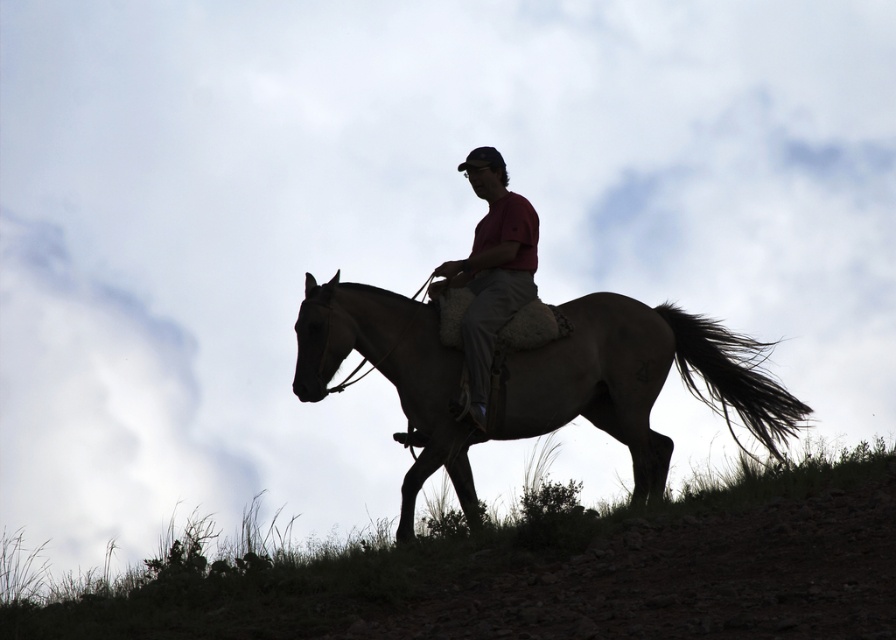
Based on the photo, can you confirm if brown textured horse at center is bigger than matte red shirt at center?

Indeed, brown textured horse at center has a larger size compared to matte red shirt at center.

Does point (530, 429) come farther from viewer compared to point (463, 266)?

No, (530, 429) is in front of (463, 266).

You are a GUI agent. You are given a task and a screenshot of the screen. Output one action in this format:
    pyautogui.click(x=<x>, y=<y>)
    Task: Click on the brown textured horse at center
    This screenshot has height=640, width=896.
    Given the screenshot: What is the action you would take?
    pyautogui.click(x=533, y=378)

Is green grass at lower center further to camera compared to brown textured horse at center?

No, it is not.

Is point (820, 627) positioned after point (409, 480)?

No, it is not.

This screenshot has height=640, width=896. Identify the location of green grass at lower center. (557, 573).

Is green grass at lower center smaller than matte red shirt at center?

No, green grass at lower center is not smaller than matte red shirt at center.

Does point (352, 634) come closer to viewer compared to point (523, 237)?

Yes.

Image resolution: width=896 pixels, height=640 pixels. In order to click on green grass at lower center in this screenshot , I will do `click(557, 573)`.